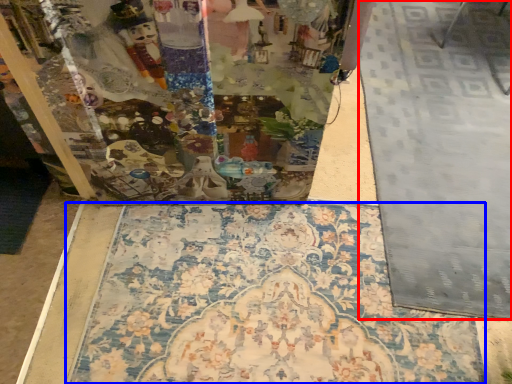
Question: Which point is closer to the camera, tile (highlighted by a red box) or mat (highlighted by a blue box)?

Choices:
 (A) tile
 (B) mat

Answer: (B)